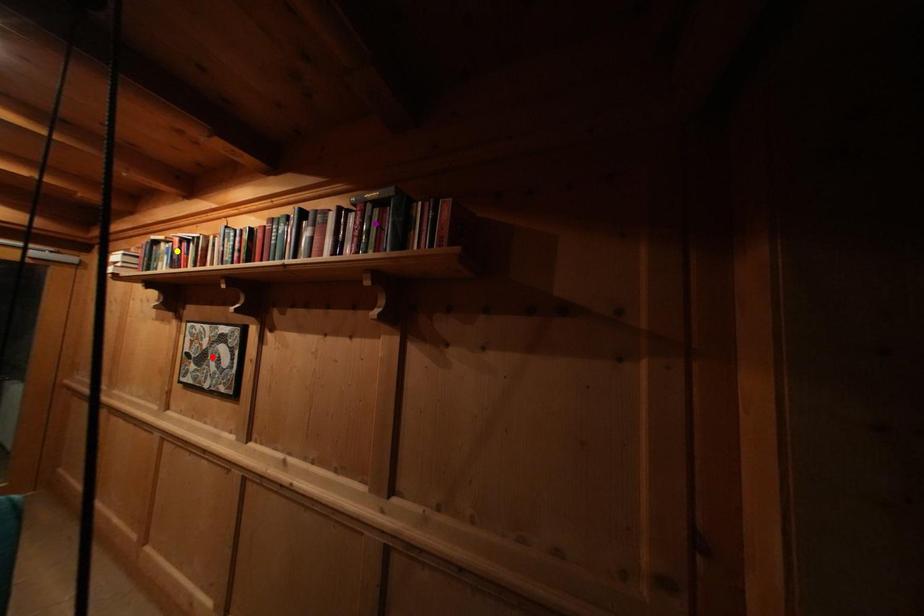
Order these from nearest to farthest:
yellow point, red point, purple point

purple point < red point < yellow point